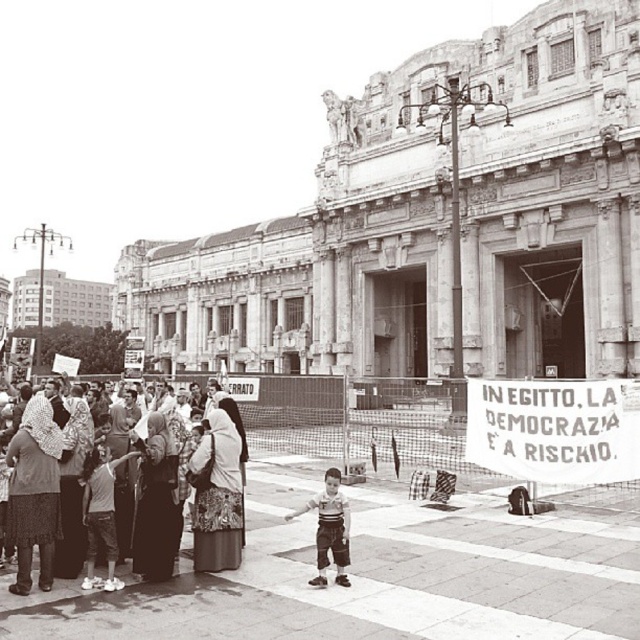
Which is behind, point (35, 476) or point (326, 484)?

Positioned behind is point (326, 484).

Does matte fabric crowd at center left have a greater height compared to light brown pants at center?

In fact, matte fabric crowd at center left may be shorter than light brown pants at center.

The image size is (640, 640). Describe the element at coordinates (35, 492) in the screenshot. I see `matte fabric crowd at center left` at that location.

Locate an element on the screen. The image size is (640, 640). matte fabric crowd at center left is located at coordinates (35, 492).